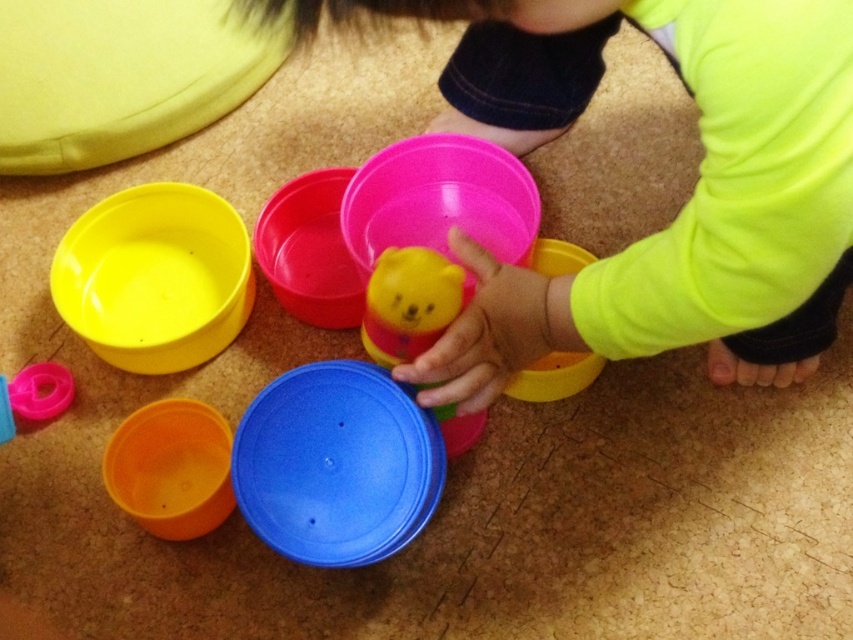
Question: Does rubber bear toy at center have a smaller size compared to matte pink ring at lower left?

Choices:
 (A) yes
 (B) no

Answer: (B)

Question: Considering the real-world distances, which object is farthest from the rubber bear toy at center?

Choices:
 (A) pink plastic bowl at center
 (B) matte plastic bowl at left
 (C) orange matte bowl at lower left
 (D) matte yellow bowl at center

Answer: (B)

Question: Which point appears farthest from the camera in this image?

Choices:
 (A) (260, 246)
 (B) (19, 384)
 (C) (167, 188)
 (D) (459, 77)

Answer: (C)

Question: Is pink plastic bowl at center to the right of matte pink ring at lower left from the viewer's perspective?

Choices:
 (A) yes
 (B) no

Answer: (A)

Question: Is pink plastic bowl at center smaller than orange matte bowl at lower left?

Choices:
 (A) no
 (B) yes

Answer: (A)

Question: Which of the following is the farthest from the observer?

Choices:
 (A) click(x=308, y=182)
 (B) click(x=538, y=256)
 (C) click(x=194, y=518)
 (D) click(x=393, y=275)

Answer: (A)